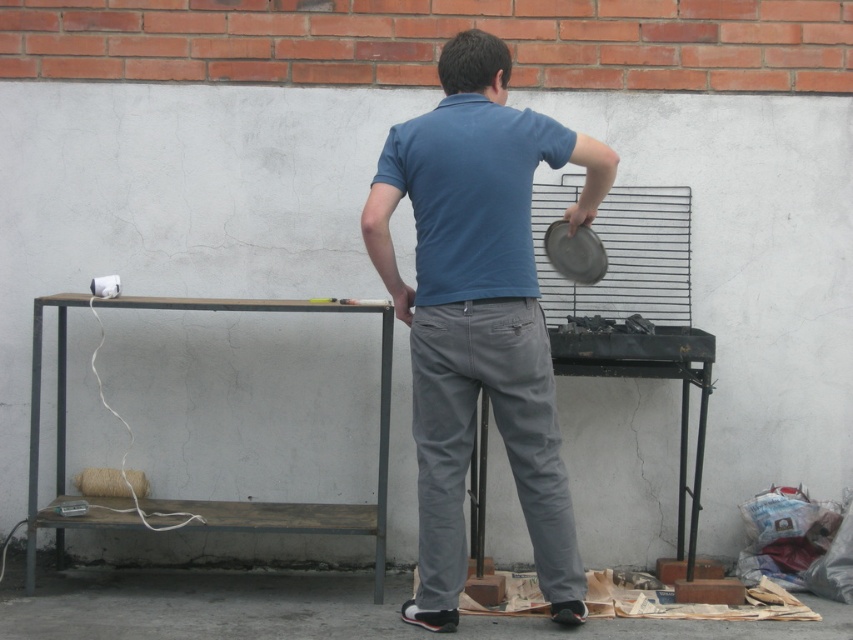
Question: Can you confirm if blue cotton shirt at center is bigger than wooden table at lower left?

Choices:
 (A) no
 (B) yes

Answer: (A)

Question: Which of the following is the closest to the observer?

Choices:
 (A) (387, 192)
 (B) (386, 356)

Answer: (A)

Question: Does blue cotton shirt at center have a greater width compared to wooden table at lower left?

Choices:
 (A) no
 (B) yes

Answer: (A)

Question: Observing the image, what is the correct spatial positioning of blue cotton shirt at center in reference to wooden table at lower left?

Choices:
 (A) left
 (B) right

Answer: (B)